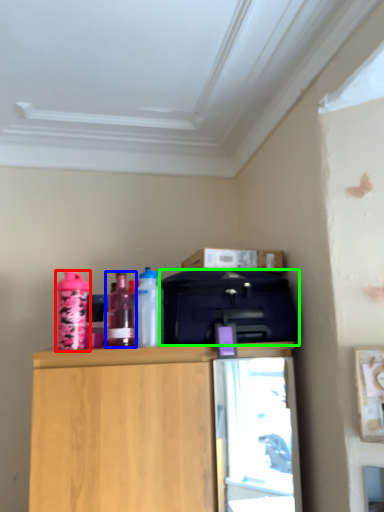
Question: Which is farther away from bottle (highlighted by a red box)? bottle (highlighted by a blue box) or luggage (highlighted by a green box)?

Choices:
 (A) bottle
 (B) luggage

Answer: (B)